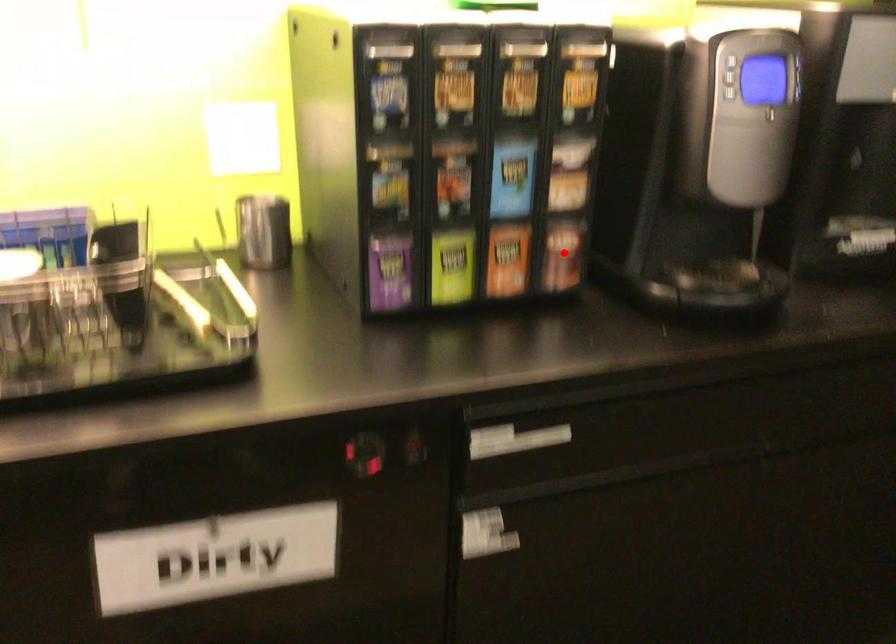
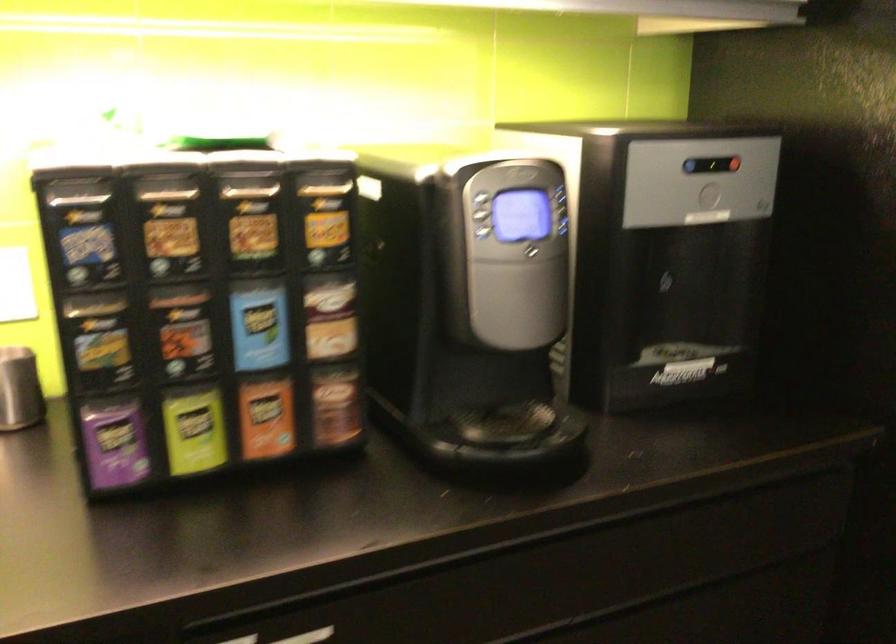
Question: I am providing you with two images of the same scene from different viewpoints. Given a red point in image1, look at the same physical point in image2. Is it:

Choices:
 (A) Closer to the viewpoint
 (B) Farther from the viewpoint

Answer: (A)